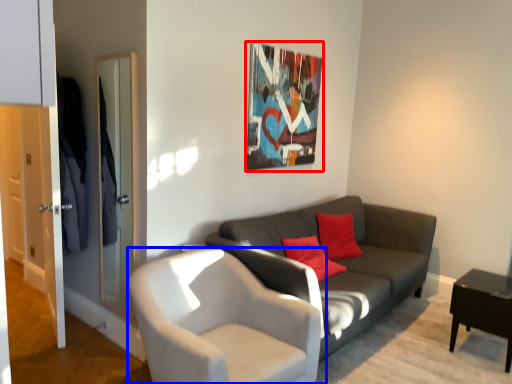
Question: Which of the following is the farthest to the observer, picture frame (highlighted by a red box) or chair (highlighted by a blue box)?

Choices:
 (A) picture frame
 (B) chair

Answer: (A)